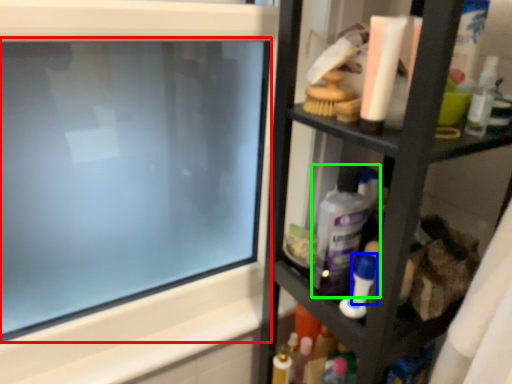
Question: Which object is positioned closest to computer screen (highlighted by a red box)? Select from toiletry (highlighted by a blue box) and cleaning product (highlighted by a green box).

Choices:
 (A) toiletry
 (B) cleaning product

Answer: (B)